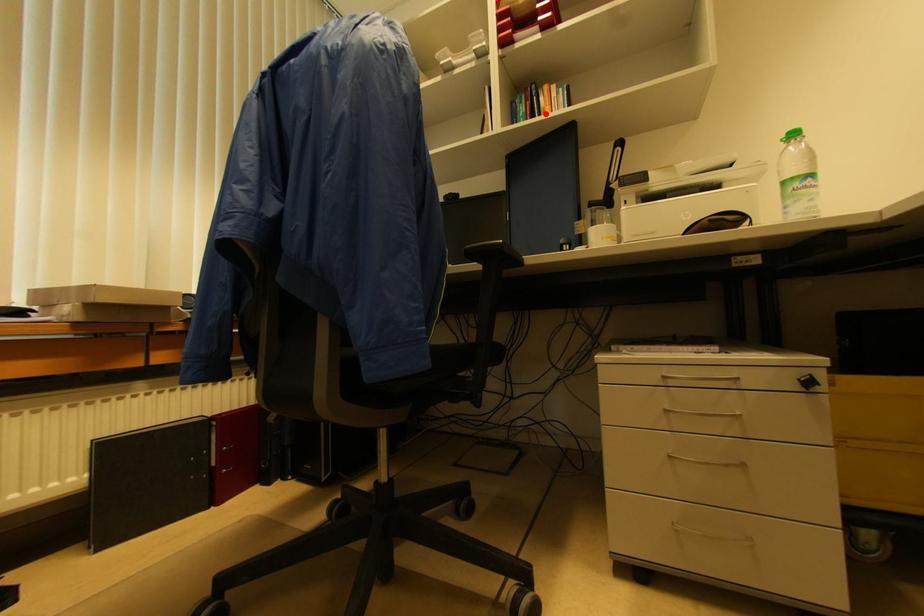
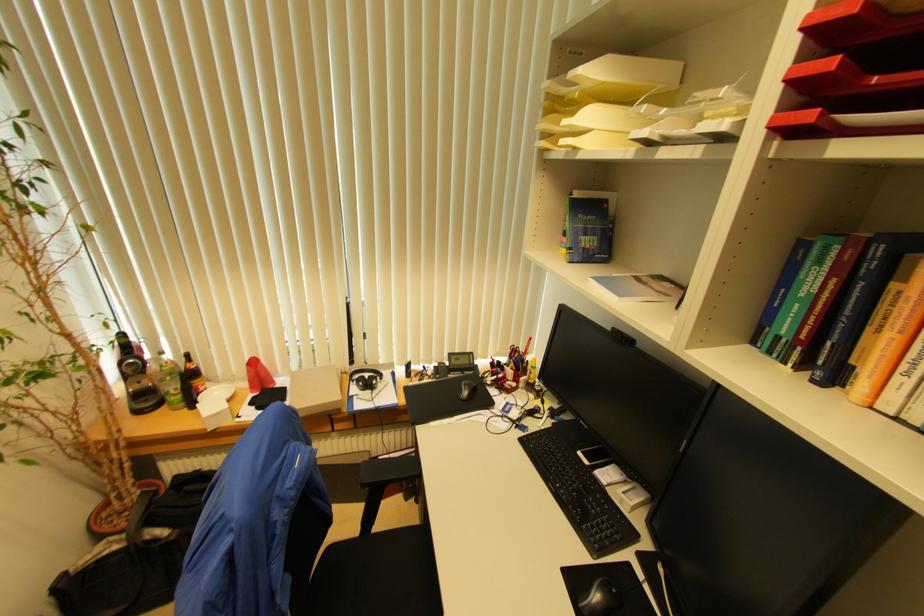
Question: I am providing you with two images of the same scene from different viewpoints. Image1 has a red point marked. In image2, the corresponding 3D location appears at what relative position? Reply with the corresponding letter.

Choices:
 (A) Closer
 (B) Farther

Answer: (B)